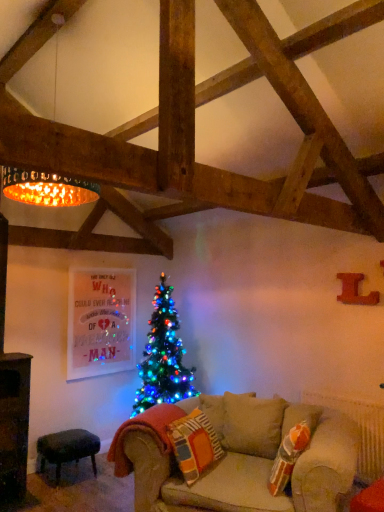
Question: Can you confirm if golden metallic lampshade at upper left is bigger than velvet dark green stool at lower left?

Choices:
 (A) no
 (B) yes

Answer: (B)

Question: Considering the relative sizes of golden metallic lampshade at upper left and velvet dark green stool at lower left in the image provided, is golden metallic lampshade at upper left taller than velvet dark green stool at lower left?

Choices:
 (A) no
 (B) yes

Answer: (B)

Question: Considering the relative sizes of golden metallic lampshade at upper left and velvet dark green stool at lower left in the image provided, is golden metallic lampshade at upper left thinner than velvet dark green stool at lower left?

Choices:
 (A) yes
 (B) no

Answer: (B)

Question: Is golden metallic lampshade at upper left in front of velvet dark green stool at lower left?

Choices:
 (A) no
 (B) yes

Answer: (B)

Question: Considering the relative sizes of golden metallic lampshade at upper left and velvet dark green stool at lower left in the image provided, is golden metallic lampshade at upper left shorter than velvet dark green stool at lower left?

Choices:
 (A) yes
 (B) no

Answer: (B)

Question: Based on their sizes in the image, would you say knitted fabric pillow at lower center is bigger or smaller than velvet dark green stool at lower left?

Choices:
 (A) big
 (B) small

Answer: (B)

Question: From the image's perspective, is knitted fabric pillow at lower center positioned above or below velvet dark green stool at lower left?

Choices:
 (A) below
 (B) above

Answer: (B)

Question: In the image, is knitted fabric pillow at lower center on the left side or the right side of velvet dark green stool at lower left?

Choices:
 (A) right
 (B) left

Answer: (A)

Question: Is knitted fabric pillow at lower center inside the boundaries of velvet dark green stool at lower left, or outside?

Choices:
 (A) inside
 (B) outside

Answer: (B)

Question: Based on their sizes in the image, would you say velvet dark green stool at lower left is bigger or smaller than golden metallic lampshade at upper left?

Choices:
 (A) small
 (B) big

Answer: (A)

Question: In terms of height, does velvet dark green stool at lower left look taller or shorter compared to golden metallic lampshade at upper left?

Choices:
 (A) tall
 (B) short

Answer: (B)

Question: Considering the relative positions of velvet dark green stool at lower left and golden metallic lampshade at upper left in the image provided, is velvet dark green stool at lower left to the left or to the right of golden metallic lampshade at upper left?

Choices:
 (A) right
 (B) left

Answer: (B)

Question: From the image's perspective, is velvet dark green stool at lower left positioned above or below golden metallic lampshade at upper left?

Choices:
 (A) below
 (B) above

Answer: (A)

Question: Does point (185, 472) appear closer or farther from the camera than point (31, 172)?

Choices:
 (A) farther
 (B) closer

Answer: (A)

Question: Considering their positions, is knitted fabric pillow at lower center located in front of or behind golden metallic lampshade at upper left?

Choices:
 (A) front
 (B) behind

Answer: (B)